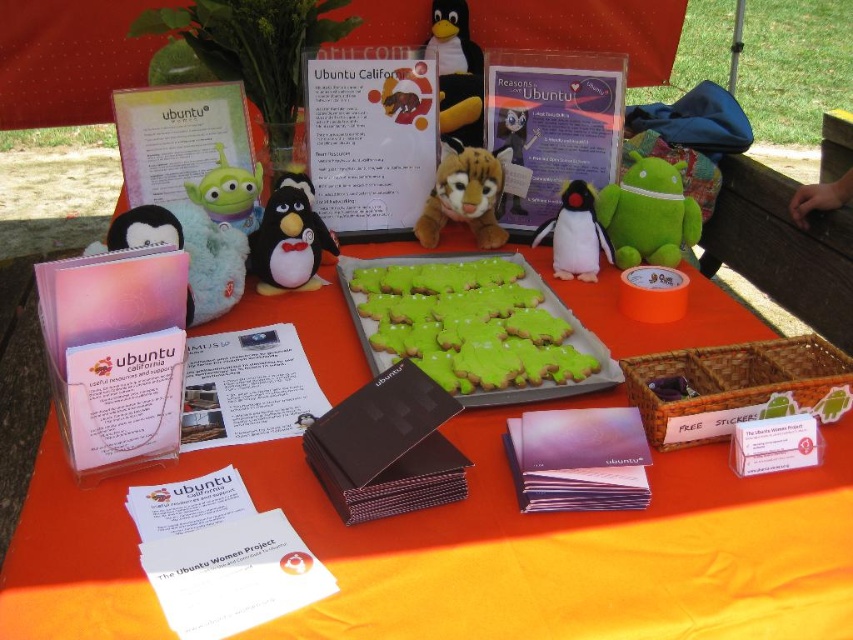
You are at an Ubuntu event and see the green plush toy at right and the plush green alien at center. Which one is located more to the right side of the table?

The green plush toy at right is more to the right than the plush green alien at center.